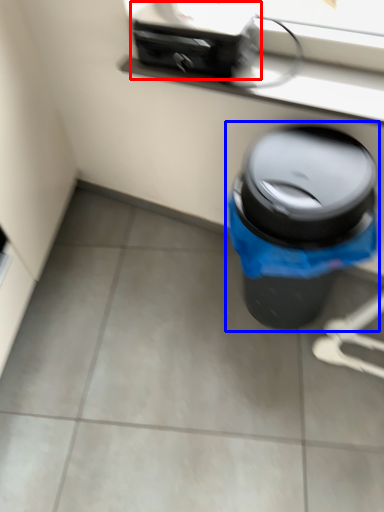
Question: Which point is further to the camera, appliance (highlighted by a red box) or waste container (highlighted by a blue box)?

Choices:
 (A) appliance
 (B) waste container

Answer: (A)